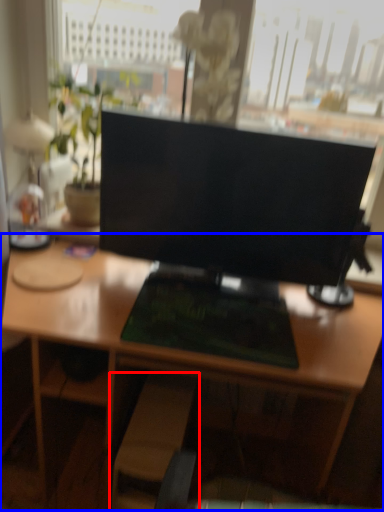
Question: Which point is closer to the camera, swivel chair (highlighted by a red box) or desk (highlighted by a blue box)?

Choices:
 (A) swivel chair
 (B) desk

Answer: (B)